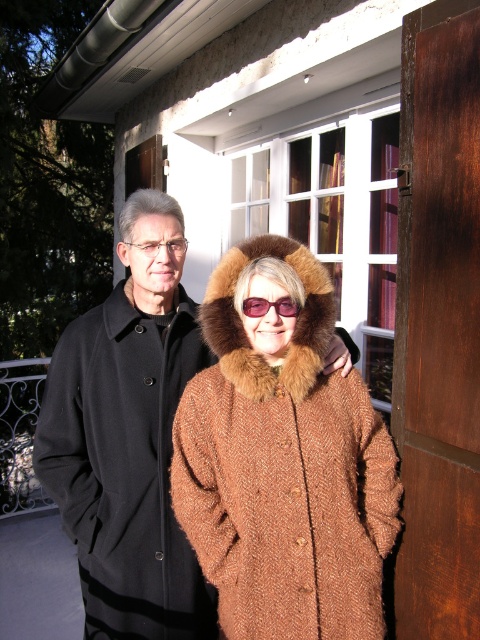
Which of these two, black wool coat at left or matte black glasses at upper left, stands shorter?

matte black glasses at upper left is shorter.

Describe the element at coordinates (128, 440) in the screenshot. The image size is (480, 640). I see `black wool coat at left` at that location.

Measure the distance between black wool coat at left and camera.

black wool coat at left is 5.97 feet from camera.

Find the location of a particular element. black wool coat at left is located at coordinates click(128, 440).

Between point (170, 632) and point (289, 298), which one is positioned in front?

Point (289, 298) is in front.

Locate an element on the screen. This screenshot has height=640, width=480. black wool coat at left is located at coordinates (128, 440).

Is brown woolen coat at center wider than pink plastic goggles at center?

Correct, the width of brown woolen coat at center exceeds that of pink plastic goggles at center.

Find the location of a particular element. This screenshot has height=640, width=480. brown woolen coat at center is located at coordinates coord(283,460).